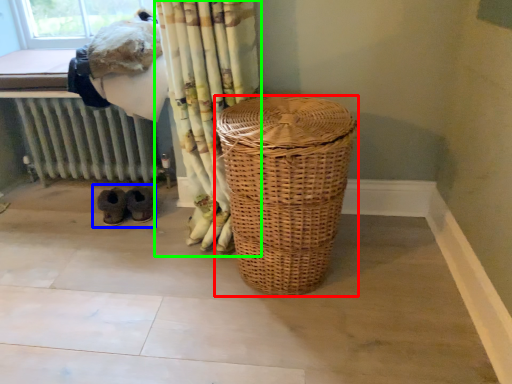
Question: Estimate the real-world distances between objects in this image. Which object is farther from laundry basket (highlighted by a red box), footwear (highlighted by a blue box) or curtain (highlighted by a green box)?

Choices:
 (A) footwear
 (B) curtain

Answer: (A)